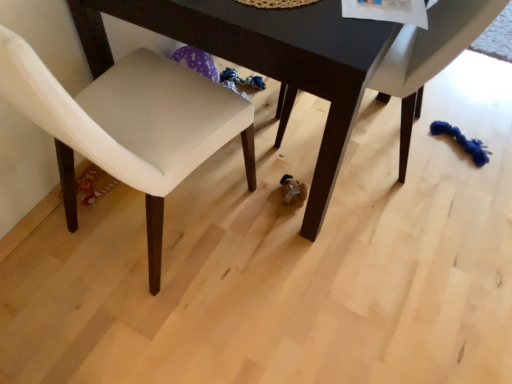
Locate an element on the screen. This screenshot has width=512, height=384. vacant area that lies in front of white fabric chair at lower right, which is the 1th chair in right-to-left order is located at coordinates (387, 234).